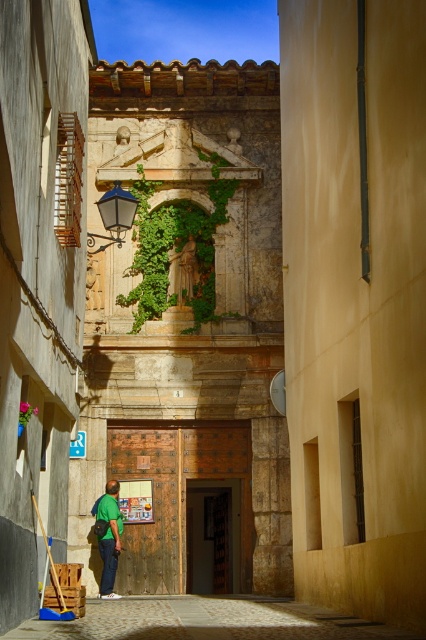
You are a delivery person trying to navigate through the alleyway. You need to place a large package on the cobblestone pavement at center. However, there is green leafy ivy at center above it. Can you place the package directly under the ivy without any obstruction?

The cobblestone pavement at center is below green leafy ivy at center, so yes, you can place the package directly under the ivy without any obstruction since the ivy is above the pavement.

You are a delivery person trying to place a large package on the cobblestone pavement at center. However, there is green leafy ivy at center in the way. Can you place the package there without damaging the ivy?

The cobblestone pavement at center has a larger size compared to green leafy ivy at center, so yes, you can place the package there without damaging the ivy as there is enough space.